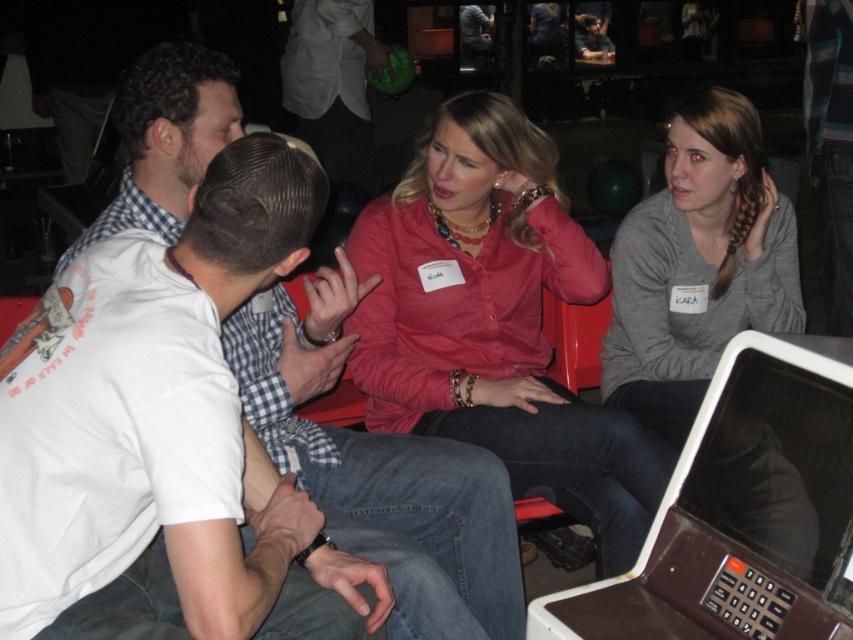
You are organizing a photo shoot and need to ensure that two models wearing the matte pink blouse at center and the gray matte shirt at center can sit side by side on a bench without overlapping. Given that the bench is 1.2 meters wide, can they fit comfortably if the total width of both garments is 1 meter?

The matte pink blouse at center is wider than the gray matte shirt at center. Since the combined width of both garments is 1 meter, which is less than the bench width of 1.2 meters, they can fit comfortably without overlapping.

You are organizing a small event and need to place a 12 inch tall decoration between the matte pink blouse at center and the brown plastic laptop at lower right. Can the decoration fit vertically between them based on their heights?

The matte pink blouse at center is taller than the brown plastic laptop at lower right. Since the decoration is 12 inches tall, it can fit vertically between them as long as the height difference between the two objects allows for the decoration to be placed without exceeding either object height. However, the exact placement would depend on the specific heights of both objects.

You are a photographer at this social event and want to capture a photo of the matte pink blouse at center and the gray matte shirt at center so that both are clearly visible. Considering their height difference, where should you position your camera to ensure both are fully in frame?

The matte pink blouse at center is much taller than the gray matte shirt at center. To ensure both are fully visible, position the camera at a lower angle so that the taller matte pink blouse at center doesn